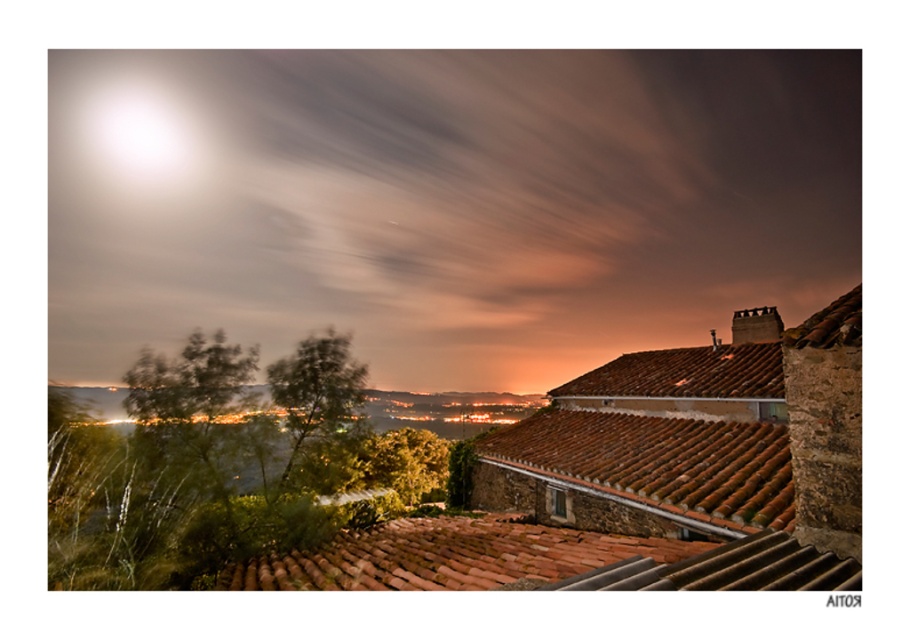
Question: Does reddish-brown clay tiles at center appear on the left side of brown tile roof at upper right?

Choices:
 (A) no
 (B) yes

Answer: (B)

Question: Which point is closer to the camera taking this photo?

Choices:
 (A) (779, 364)
 (B) (378, 524)
 (C) (612, 314)

Answer: (A)

Question: Which object is closer to the camera taking this photo?

Choices:
 (A) brown tile roof at upper right
 (B) reddish-brown clay tiles at center
 (C) matte orange cloud at upper center

Answer: (B)

Question: Is reddish-brown clay tiles at center above brown tile roof at upper right?

Choices:
 (A) yes
 (B) no

Answer: (B)

Question: Is matte orange cloud at upper center positioned before brown tile roof at upper right?

Choices:
 (A) yes
 (B) no

Answer: (B)

Question: Which object appears farthest from the camera in this image?

Choices:
 (A) matte orange cloud at upper center
 (B) brown tile roof at upper right
 (C) reddish-brown clay tiles at center

Answer: (A)